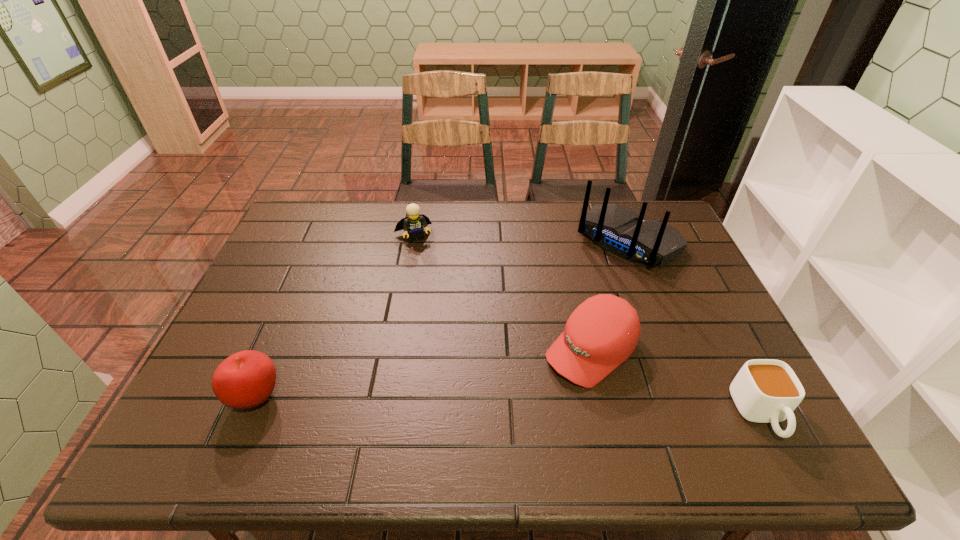
The height and width of the screenshot is (540, 960). In order to click on object positioned at the left edge in this screenshot , I will do `click(246, 379)`.

Locate an element on the screen. The height and width of the screenshot is (540, 960). cup located at the right edge is located at coordinates (765, 390).

Find the location of a particular element. The width and height of the screenshot is (960, 540). router that is at the right edge is located at coordinates (616, 229).

Find the location of a particular element. The width and height of the screenshot is (960, 540). object present at the near left corner is located at coordinates [x=246, y=379].

Find the location of a particular element. The width and height of the screenshot is (960, 540). object at the far right corner is located at coordinates pyautogui.click(x=616, y=229).

Locate an element on the screen. The height and width of the screenshot is (540, 960). object at the near right corner is located at coordinates (765, 390).

The image size is (960, 540). Identify the location of vacant space at the far edge of the desktop. (457, 215).

You are a GUI agent. You are given a task and a screenshot of the screen. Output one action in this format:
    pyautogui.click(x=<x>, y=<y>)
    Task: Click on the vacant region at the near edge of the desktop
    
    Given the screenshot: What is the action you would take?
    pyautogui.click(x=353, y=413)

You are a GUI agent. You are given a task and a screenshot of the screen. Output one action in this format:
    pyautogui.click(x=<x>, y=<y>)
    Task: Click on the free space at the right edge
    This screenshot has width=960, height=540.
    Given the screenshot: What is the action you would take?
    pyautogui.click(x=666, y=284)

What are the coordinates of `vacant space at the far left corner` in the screenshot? It's located at (328, 211).